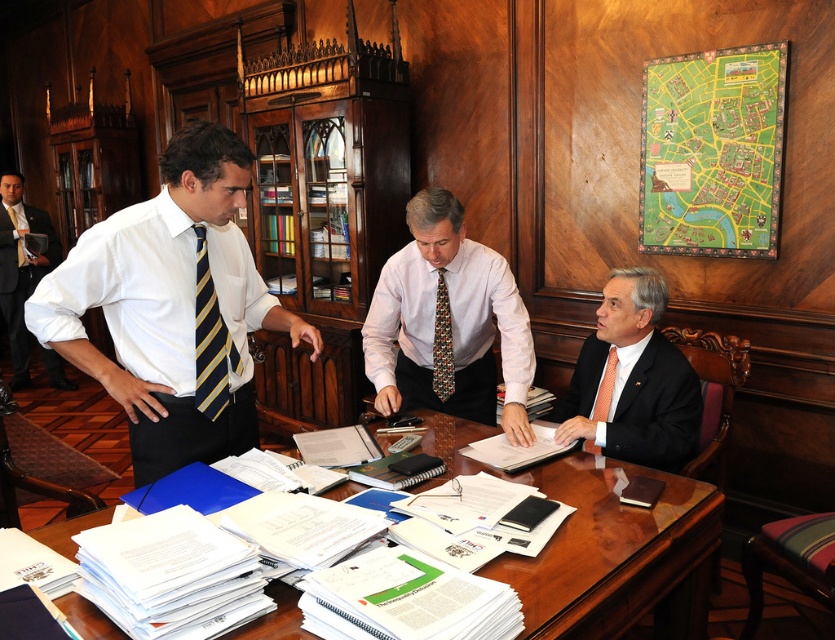
Who is lower down, wooden at center or matte black suit at right?

wooden at center is below.

Identify the location of wooden at center. The width and height of the screenshot is (835, 640). (601, 545).

Is matte black suit at right below white shirt at left?

Yes.

Between point (588, 392) and point (0, 221), which one is positioned in front?

Point (588, 392) is in front.

The image size is (835, 640). I want to click on matte black suit at right, so click(656, 410).

Describe the element at coordinates (19, 268) in the screenshot. I see `white shirt at left` at that location.

Can you confirm if white shirt at left is positioned to the right of orange silk tie at right?

Incorrect, white shirt at left is not on the right side of orange silk tie at right.

In order to click on white shirt at left in this screenshot , I will do (x=19, y=268).